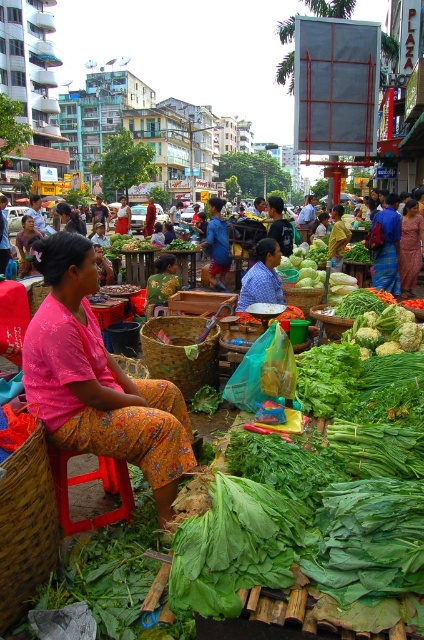
Question: Does brown woven basket at lower left lie in front of green textured blouse at center?

Choices:
 (A) no
 (B) yes

Answer: (B)

Question: Does pink fabric skirt at center have a smaller size compared to matte pink blouse at center?

Choices:
 (A) yes
 (B) no

Answer: (B)

Question: Which of the following is the closest to the observer?

Choices:
 (A) (150, 600)
 (B) (141, 364)
 (C) (25, 576)

Answer: (A)

Question: From the image, what is the correct spatial relationship of green leafy vegetables at center in relation to green textured blouse at center?

Choices:
 (A) right
 (B) left

Answer: (A)

Question: Which object appears farthest from the camera in this image?

Choices:
 (A) pink fabric skirt at center
 (B) brown woven basket at lower left
 (C) brown woven basket at center

Answer: (C)

Question: Which point is farther to the camera?

Choices:
 (A) (301, 308)
 (B) (139, 369)

Answer: (A)